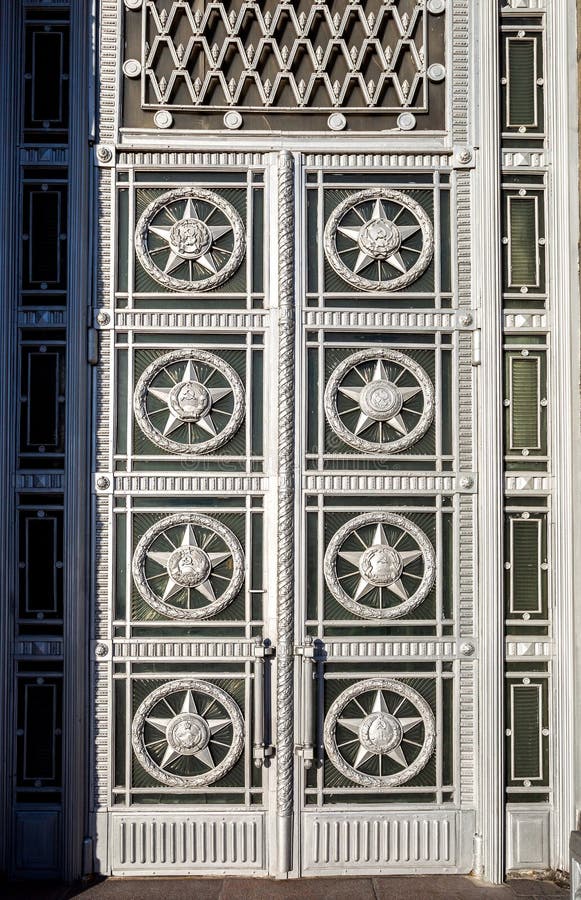
Locate an element on the screen. This screenshot has height=900, width=581. right pillar is located at coordinates (490, 748).